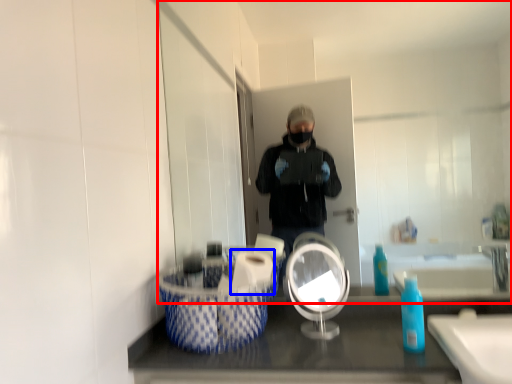
Question: Which point is further to the camera, mirror (highlighted by a red box) or toilet paper (highlighted by a blue box)?

Choices:
 (A) mirror
 (B) toilet paper

Answer: (A)